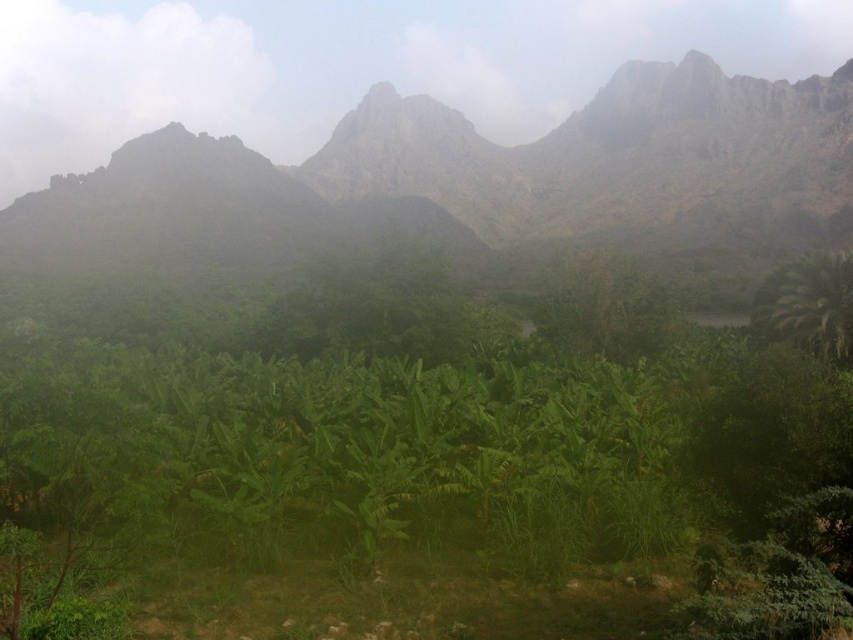
Is the position of rugged stone mountain range at upper center more distant than that of green leafy palm at right?

Yes, rugged stone mountain range at upper center is behind green leafy palm at right.

Which is more to the left, rugged stone mountain range at upper center or green leafy palm at right?

rugged stone mountain range at upper center

Find the location of a particular element. rugged stone mountain range at upper center is located at coordinates (618, 161).